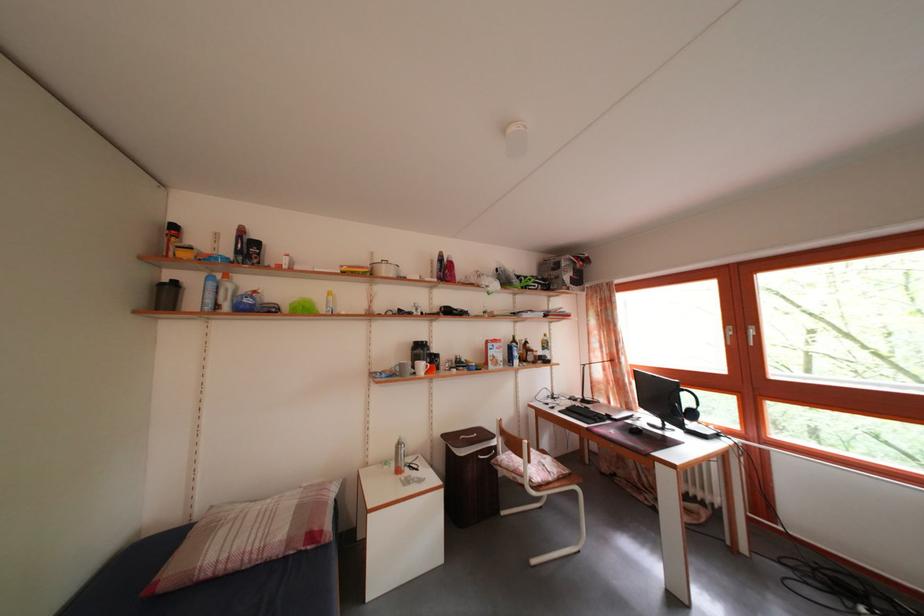
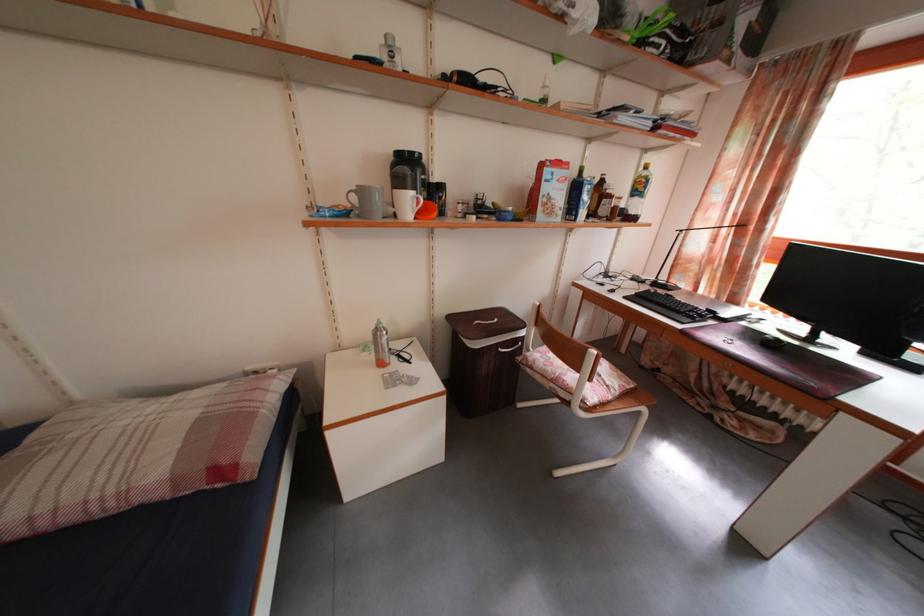
Locate, in the second image, the point that corresponds to pixel 405 376 in the first image.

(361, 206)